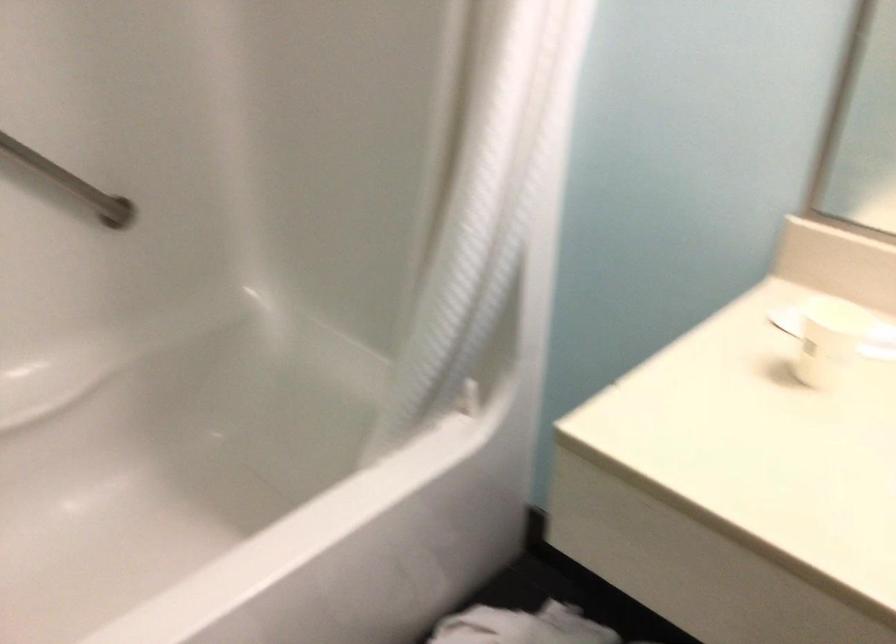
Question: The camera is either moving clockwise (left) or counter-clockwise (right) around the object. The first image is from the beginning of the video and the second image is from the end. Is the camera moving left or right when shooting the video?

Choices:
 (A) Left
 (B) Right

Answer: (B)